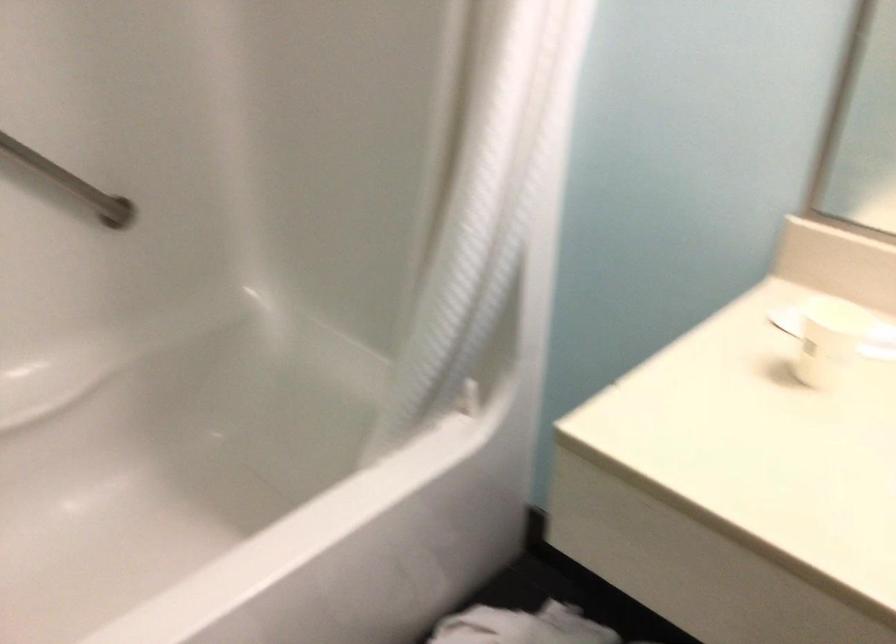
Question: The camera is either moving clockwise (left) or counter-clockwise (right) around the object. The first image is from the beginning of the video and the second image is from the end. Is the camera moving left or right when shooting the video?

Choices:
 (A) Left
 (B) Right

Answer: (B)